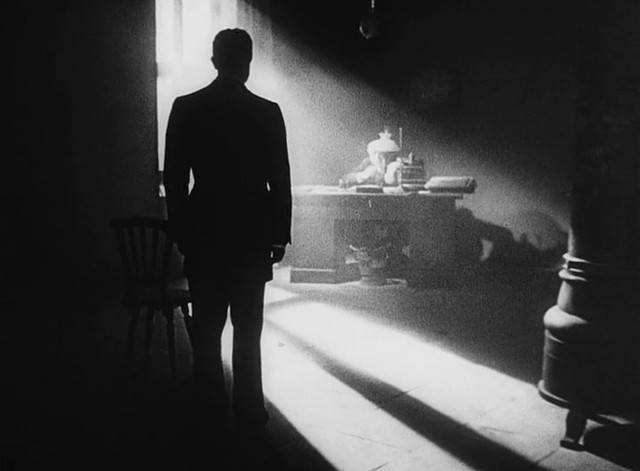
This screenshot has height=471, width=640. I want to click on wall, so click(523, 174).